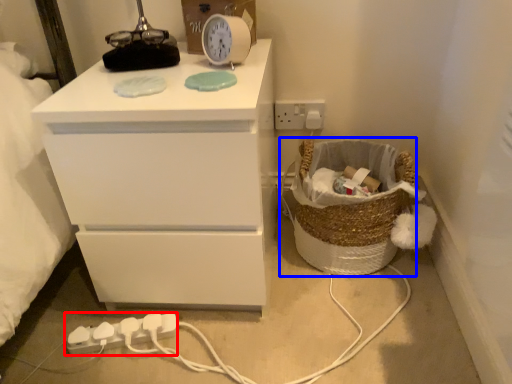
Question: Which point is further to the camera, extension cord (highlighted by a red box) or basket (highlighted by a blue box)?

Choices:
 (A) extension cord
 (B) basket

Answer: (A)